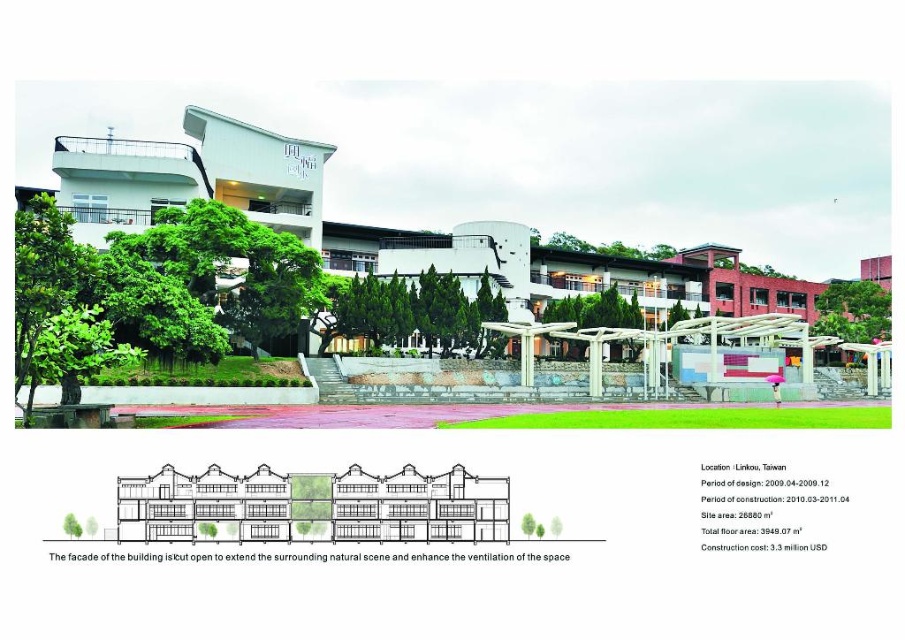
Which of these two, green leafy tree at right or green leafy tree at upper center, stands taller?

With more height is green leafy tree at right.

Can you confirm if green leafy tree at right is positioned above green leafy tree at upper center?

No, green leafy tree at right is not above green leafy tree at upper center.

Which is behind, point (883, 326) or point (579, 244)?

Positioned behind is point (579, 244).

This screenshot has height=640, width=905. Identify the location of green leafy tree at right. (853, 310).

Looking at this image, between green textured tree at center and green leafy tree at center, which one is positioned higher?

green leafy tree at center is above.

Between green textured tree at center and green leafy tree at center, which one has more height?

green leafy tree at center

Which is behind, point (501, 317) or point (621, 317)?

Point (621, 317)

The image size is (905, 640). Find the location of `green textured tree at center`. green textured tree at center is located at coordinates (411, 308).

Describe the element at coordinates (596, 308) in the screenshot. I see `green leafy tree at center` at that location.

Measure the distance from green leafy tree at center to green leafy tree at upper center.

green leafy tree at center is 41.98 meters away from green leafy tree at upper center.

Where is `green leafy tree at center`? The width and height of the screenshot is (905, 640). green leafy tree at center is located at coordinates (596, 308).